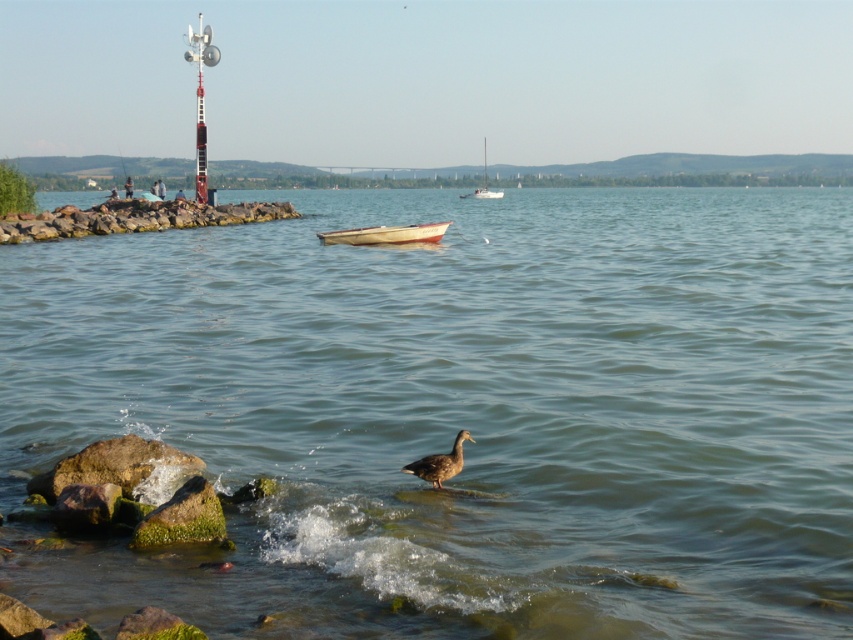
Question: Which object is the closest to the white sailboat at center?

Choices:
 (A) brown matte duck at center
 (B) white matte boat at center

Answer: (B)

Question: Which point appears closest to the camera in this image?

Choices:
 (A) (332, 234)
 (B) (421, 472)

Answer: (B)

Question: Is brown matte duck at center above white sailboat at center?

Choices:
 (A) no
 (B) yes

Answer: (A)

Question: Can you confirm if greenish water at center is positioned to the left of brown matte duck at center?

Choices:
 (A) no
 (B) yes

Answer: (A)

Question: Which of these objects is positioned farthest from the brown matte duck at center?

Choices:
 (A) greenish water at center
 (B) white matte boat at center

Answer: (B)

Question: Does greenish water at center appear on the right side of brown matte duck at center?

Choices:
 (A) yes
 (B) no

Answer: (A)